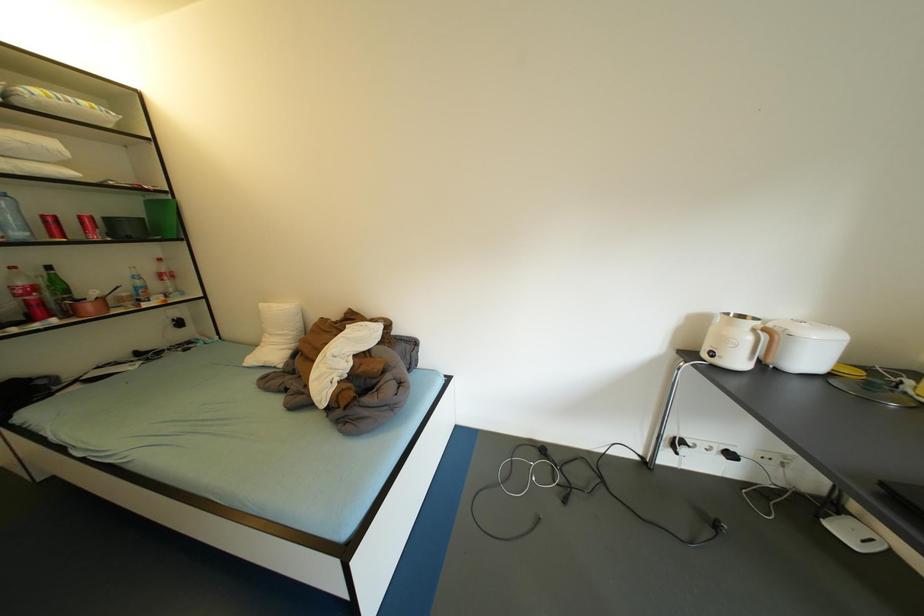
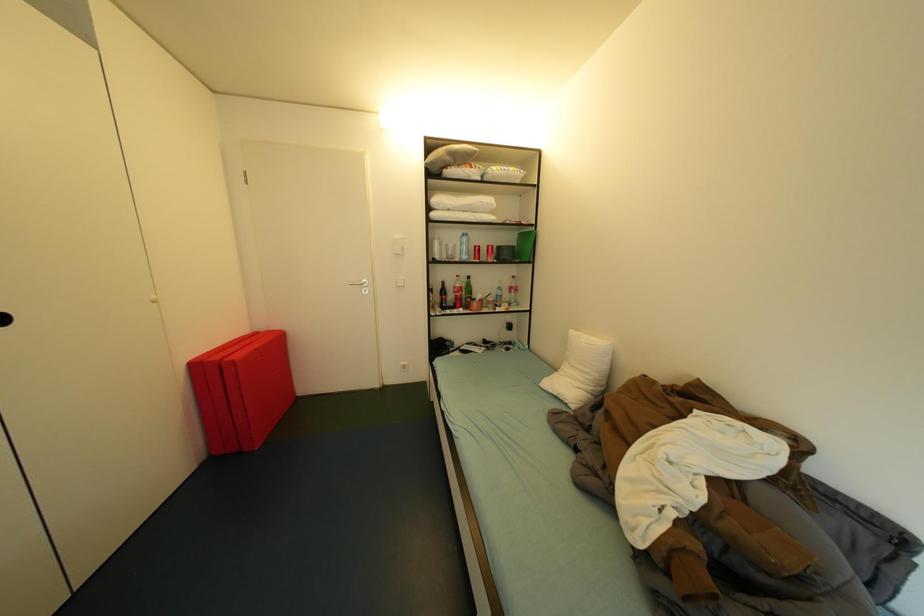
Question: The camera is either moving clockwise (left) or counter-clockwise (right) around the object. The first image is from the beginning of the video and the second image is from the end. Is the camera moving left or right when shooting the video?

Choices:
 (A) Left
 (B) Right

Answer: (B)